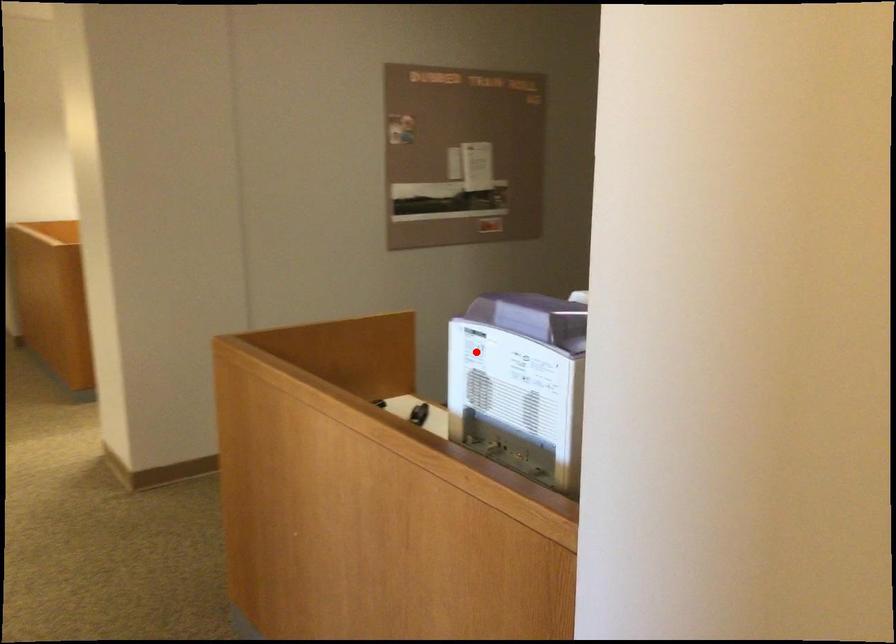
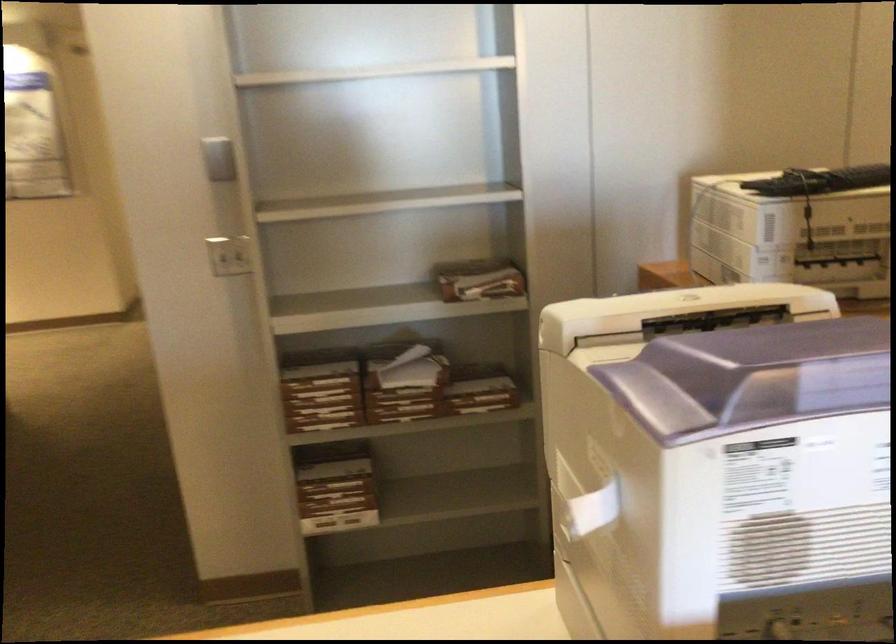
Question: A red point is marked in image1. In image2, is the corresponding 3D point closer to the camera or farther? Reply with the corresponding letter.

Choices:
 (A) The corresponding 3D point is closer.
 (B) The corresponding 3D point is farther.

Answer: (A)